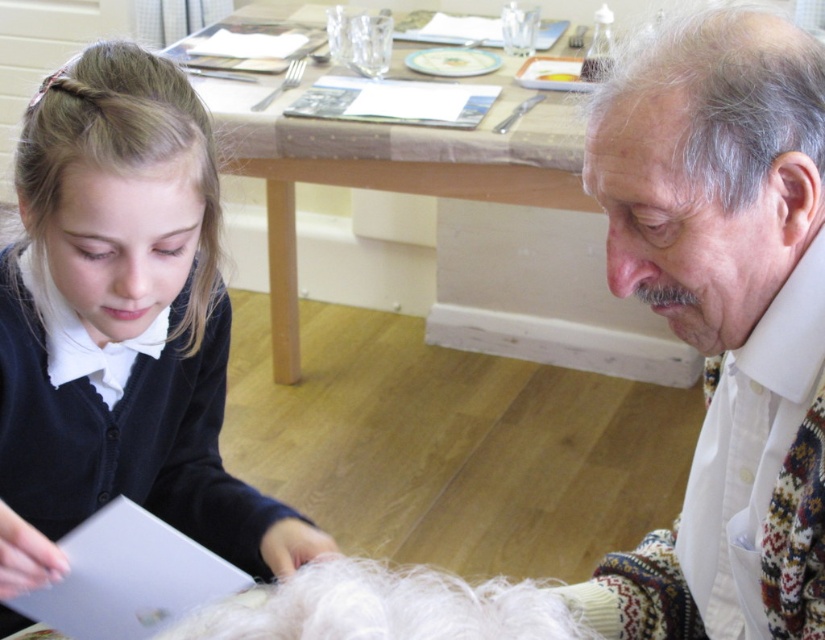
Looking at this image, does matte black cardigan at lower left have a greater width compared to gray matte hair at upper right?

Indeed, matte black cardigan at lower left has a greater width compared to gray matte hair at upper right.

Does matte black cardigan at lower left appear under gray matte hair at upper right?

Correct, matte black cardigan at lower left is located below gray matte hair at upper right.

Does point (258, 512) come behind point (694, 170)?

Yes.

Identify the location of matte black cardigan at lower left. The height and width of the screenshot is (640, 825). (121, 324).

Is point (635, 273) farther from camera compared to point (649, 44)?

That is True.

Is white textured scarf at right further to the viewer compared to gray matte hair at upper right?

Yes.

Which is behind, point (752, 273) or point (818, 93)?

The point (752, 273) is behind.

Where is `white textured scarf at right`? This screenshot has height=640, width=825. white textured scarf at right is located at coordinates point(724,316).

Between point (734, 144) and point (200, 173), which one is positioned behind?

Point (200, 173)

Consider the image. Is white textured scarf at right shorter than matte black cardigan at lower left?

Yes.

This screenshot has width=825, height=640. What do you see at coordinates (724, 316) in the screenshot?
I see `white textured scarf at right` at bounding box center [724, 316].

I want to click on white textured scarf at right, so click(724, 316).